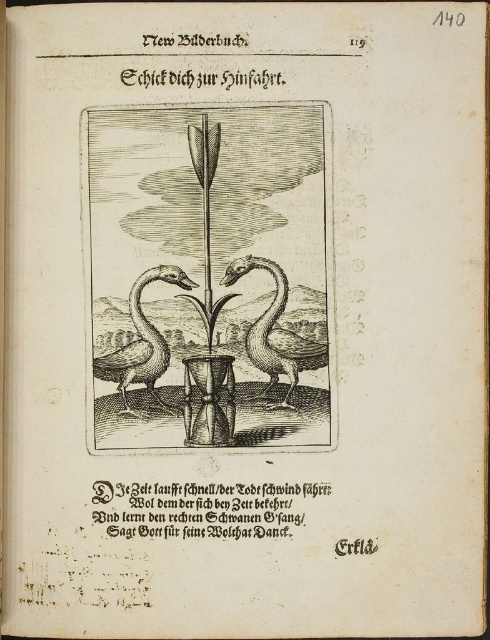
Does wooden pedestal with two swans at center have a lesser height compared to gray wood swan at left?

In fact, wooden pedestal with two swans at center may be taller than gray wood swan at left.

Between point (248, 445) and point (140, 371), which one is positioned in front?

Point (248, 445) is more forward.

The height and width of the screenshot is (640, 490). In order to click on wooden pedestal with two swans at center in this screenshot , I will do `click(210, 275)`.

Is wooden pedestal with two swans at center above smooth silver swan at center?

Yes, wooden pedestal with two swans at center is above smooth silver swan at center.

Is wooden pedestal with two swans at center positioned before smooth silver swan at center?

Yes, wooden pedestal with two swans at center is in front of smooth silver swan at center.

Which is in front, point (202, 266) or point (291, 368)?

Positioned in front is point (202, 266).

The image size is (490, 640). In order to click on wooden pedestal with two swans at center in this screenshot , I will do `click(210, 275)`.

Can you confirm if smooth silver swan at center is shorter than gray wood swan at left?

Incorrect, smooth silver swan at center's height does not fall short of gray wood swan at left's.

Does smooth silver swan at center have a smaller size compared to gray wood swan at left?

Incorrect, smooth silver swan at center is not smaller in size than gray wood swan at left.

I want to click on smooth silver swan at center, so click(x=274, y=332).